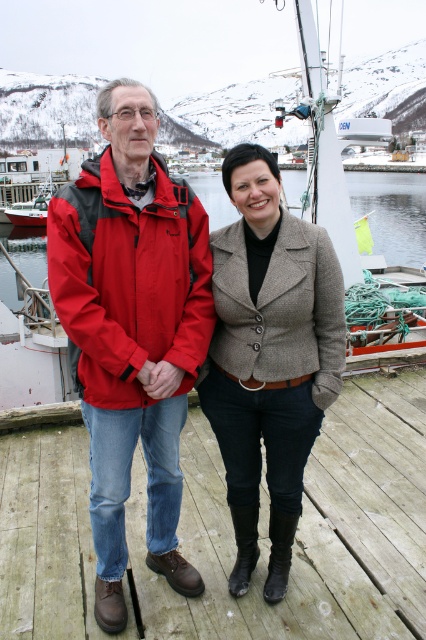
You are a photographer trying to capture both the wooden at center and the red matte jacket at left in a single frame. Which object should you focus on first to ensure both are in the shot?

The wooden at center is shorter than the red matte jacket at left, so you should focus on the red matte jacket at left first to ensure both are in the shot.